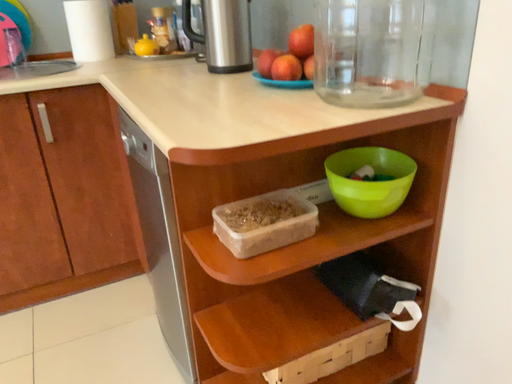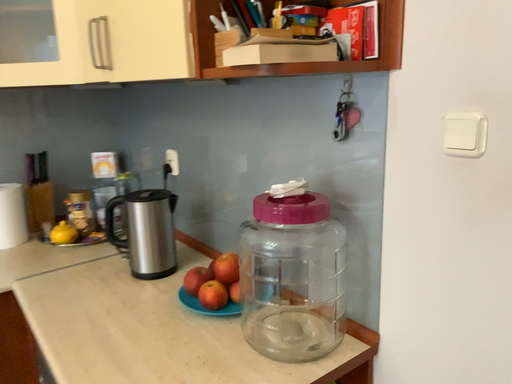
Question: Which way did the camera rotate in the video?

Choices:
 (A) rotated downward
 (B) rotated upward

Answer: (B)